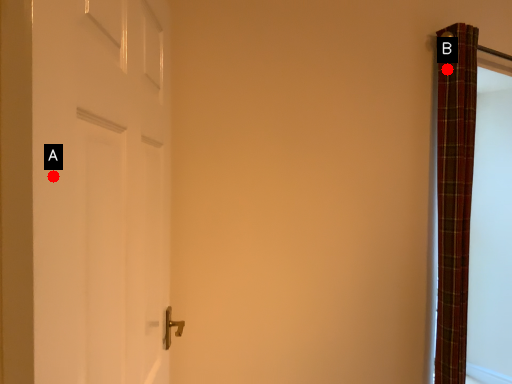
Question: Two points are circled on the image, labeled by A and B beside each circle. Which of the following is the farthest from the observer?

Choices:
 (A) A is further
 (B) B is further

Answer: (B)